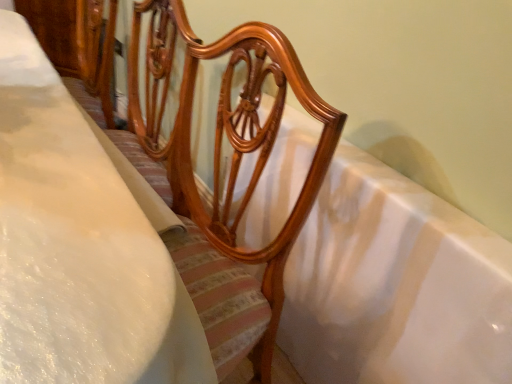
Question: Is white glossy bathtub at center taller or shorter than white soft bedsheet at center?

Choices:
 (A) short
 (B) tall

Answer: (A)

Question: From the image's perspective, is white glossy bathtub at center positioned above or below white soft bedsheet at center?

Choices:
 (A) above
 (B) below

Answer: (B)

Question: In terms of width, does white glossy bathtub at center look wider or thinner when compared to white soft bedsheet at center?

Choices:
 (A) thin
 (B) wide

Answer: (A)

Question: Visually, is white soft bedsheet at center positioned to the left or to the right of white glossy bathtub at center?

Choices:
 (A) right
 (B) left

Answer: (B)

Question: Do you think white soft bedsheet at center is within white glossy bathtub at center, or outside of it?

Choices:
 (A) inside
 (B) outside

Answer: (B)

Question: Is point (138, 357) closer or farther from the camera than point (256, 206)?

Choices:
 (A) farther
 (B) closer

Answer: (B)

Question: In the image, is white soft bedsheet at center positioned in front of or behind white glossy bathtub at center?

Choices:
 (A) behind
 (B) front

Answer: (B)